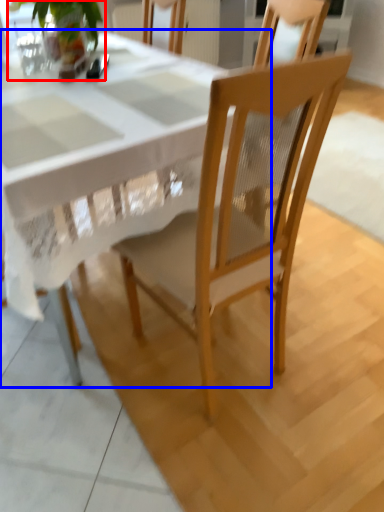
Question: Which of the following is the closest to the observer, houseplant (highlighted by a red box) or round table (highlighted by a blue box)?

Choices:
 (A) houseplant
 (B) round table

Answer: (B)